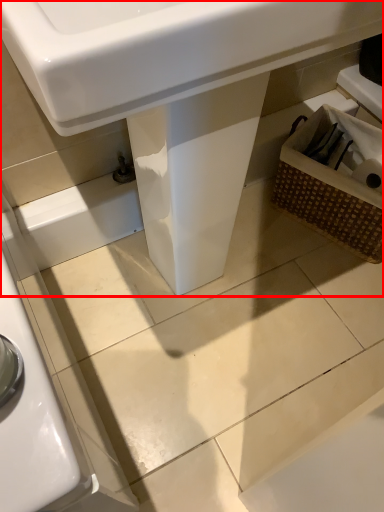
Question: From the image's perspective, what is the correct spatial relationship of sink (annotated by the red box) in relation to basket?

Choices:
 (A) above
 (B) below

Answer: (A)